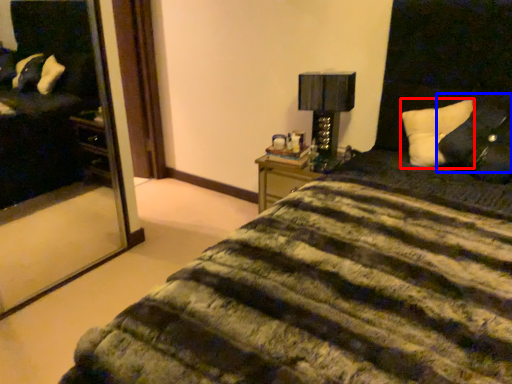
Question: Which of the following is the farthest to the observer, pillow (highlighted by a red box) or pillow (highlighted by a blue box)?

Choices:
 (A) pillow
 (B) pillow

Answer: (A)